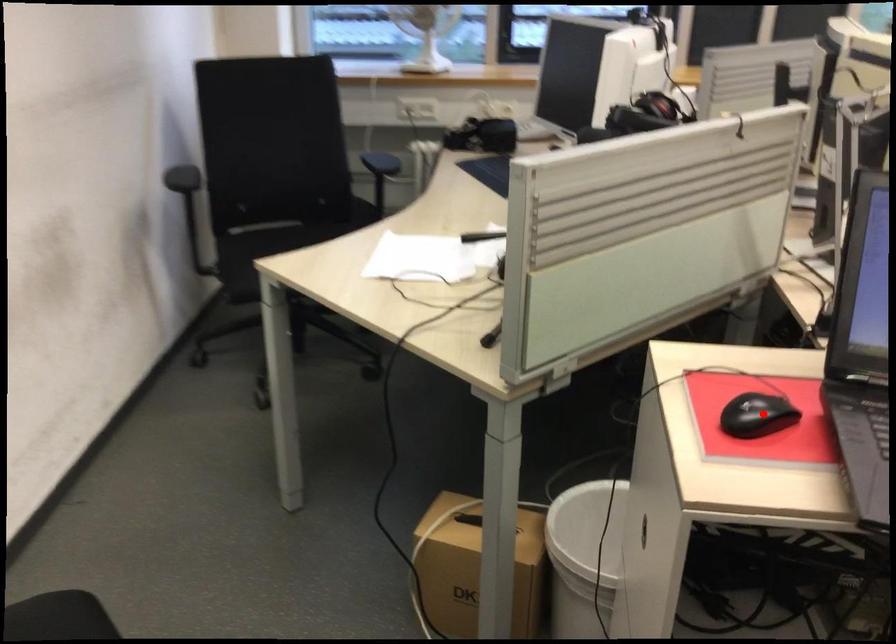
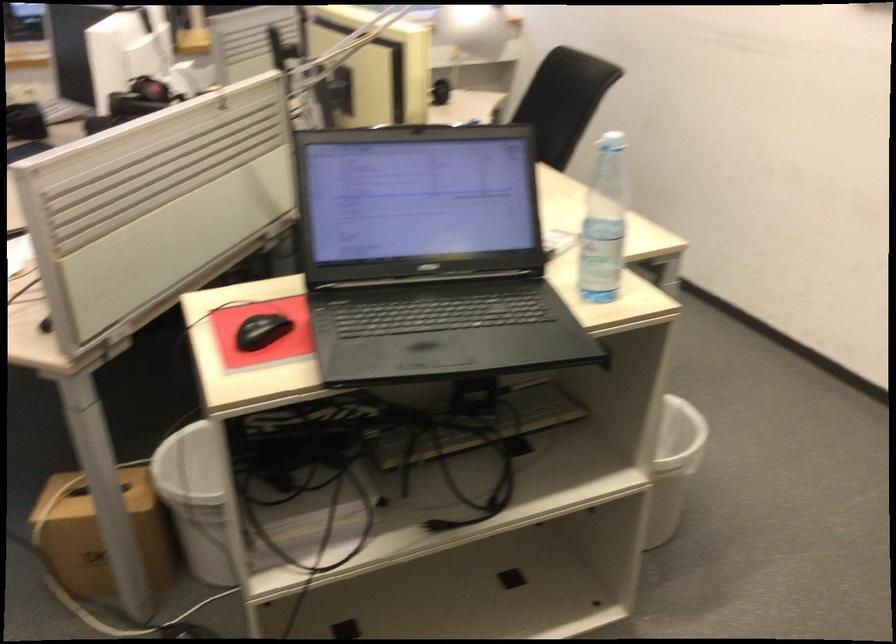
Question: I am providing you with two images of the same scene from different viewpoints. Image1 has a red point marked. In image2, the corresponding 3D location appears at what relative position? Reply with the corresponding letter.

Choices:
 (A) Closer
 (B) Farther

Answer: (B)